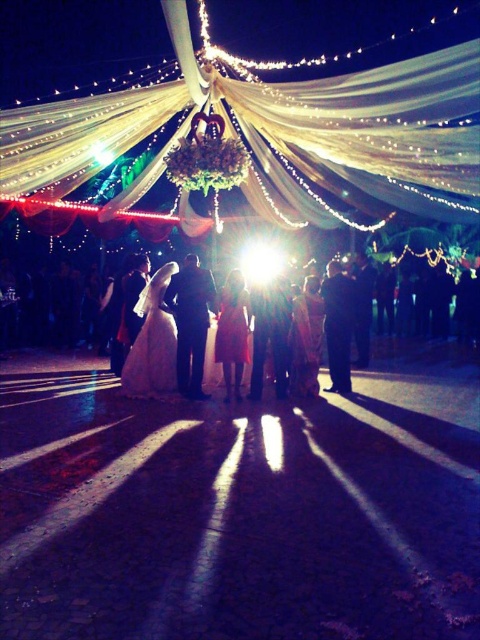
Question: Which object is farther from the camera taking this photo?

Choices:
 (A) illuminated sheer fabric canopy at upper center
 (B) white satin dress at center

Answer: (B)

Question: Does illuminated sheer fabric canopy at upper center appear on the left side of white satin dress at center?

Choices:
 (A) yes
 (B) no

Answer: (B)

Question: Where is illuminated sheer fabric canopy at upper center located in relation to white satin dress at center in the image?

Choices:
 (A) above
 (B) below

Answer: (A)

Question: Does illuminated sheer fabric canopy at upper center appear on the right side of white satin dress at center?

Choices:
 (A) no
 (B) yes

Answer: (B)

Question: Which point is closer to the camera?

Choices:
 (A) pyautogui.click(x=158, y=355)
 (B) pyautogui.click(x=96, y=118)

Answer: (A)